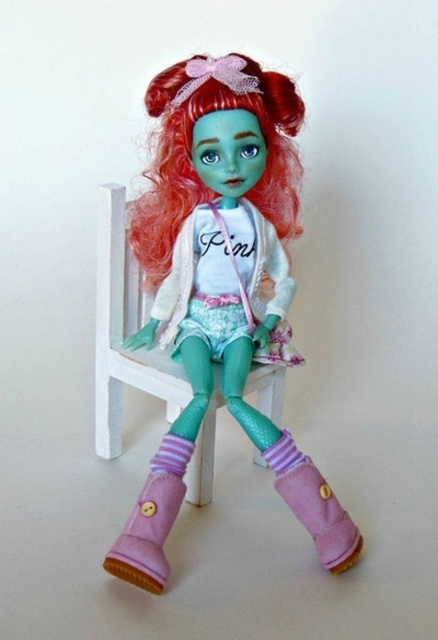
Between matte pink boots at center and white wooden chair at center, which one has more height?

matte pink boots at center is taller.

Identify the location of matte pink boots at center. (230, 259).

The height and width of the screenshot is (640, 438). Identify the location of matte pink boots at center. (230, 259).

This screenshot has width=438, height=640. I want to click on matte pink boots at center, so click(x=230, y=259).

Is shiny red hair at center thinner than white wooden chair at center?

Yes.

Is shiny red hair at center closer to camera compared to white wooden chair at center?

That is True.

Is point (141, 252) positioned after point (204, 472)?

Yes, it is behind point (204, 472).

Find the location of a particular element. This screenshot has width=438, height=640. shiny red hair at center is located at coordinates (190, 157).

Is matte white dress at center positioned before pink striped sock at lower center?

No, it is not.

Does matte white dress at center appear on the right side of pink striped sock at lower center?

Correct, you'll find matte white dress at center to the right of pink striped sock at lower center.

Which is in front, point (268, 305) or point (173, 442)?

Point (173, 442) is in front.

Identify the location of matte white dress at center. This screenshot has height=640, width=438. (176, 284).